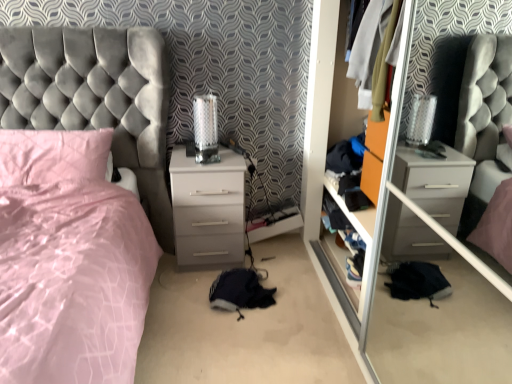
Identify the location of free location in front of wooden shelf at center. The height and width of the screenshot is (384, 512). (361, 332).